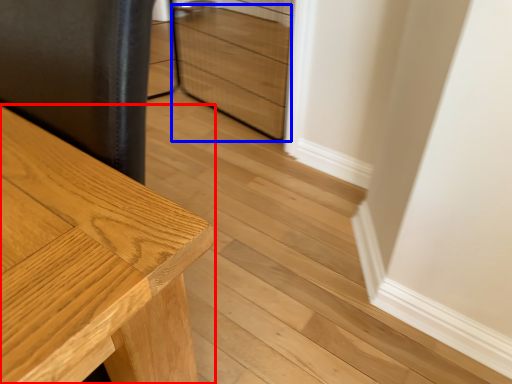
Question: Which object appears farthest to the camera in this image, table (highlighted by a red box) or drawer (highlighted by a blue box)?

Choices:
 (A) table
 (B) drawer

Answer: (B)